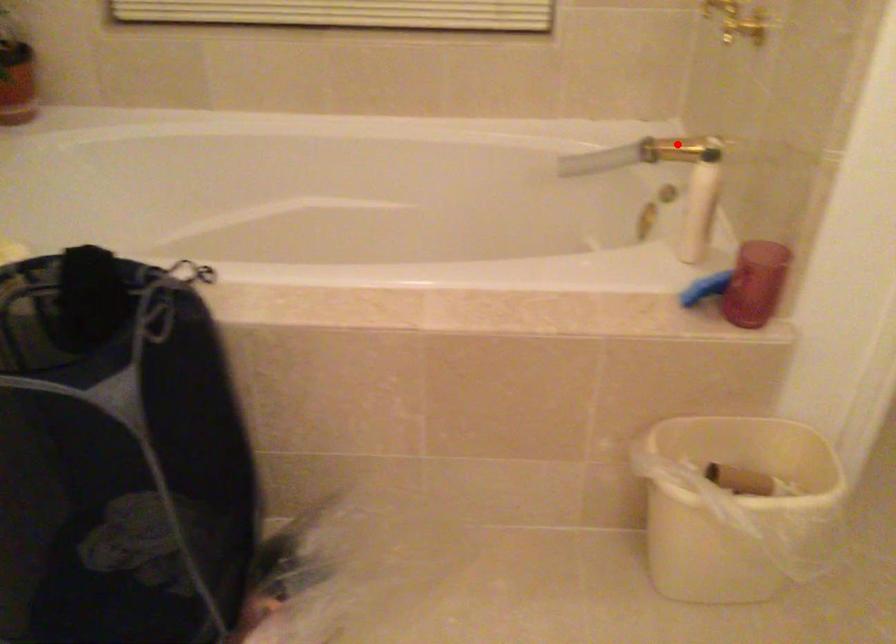
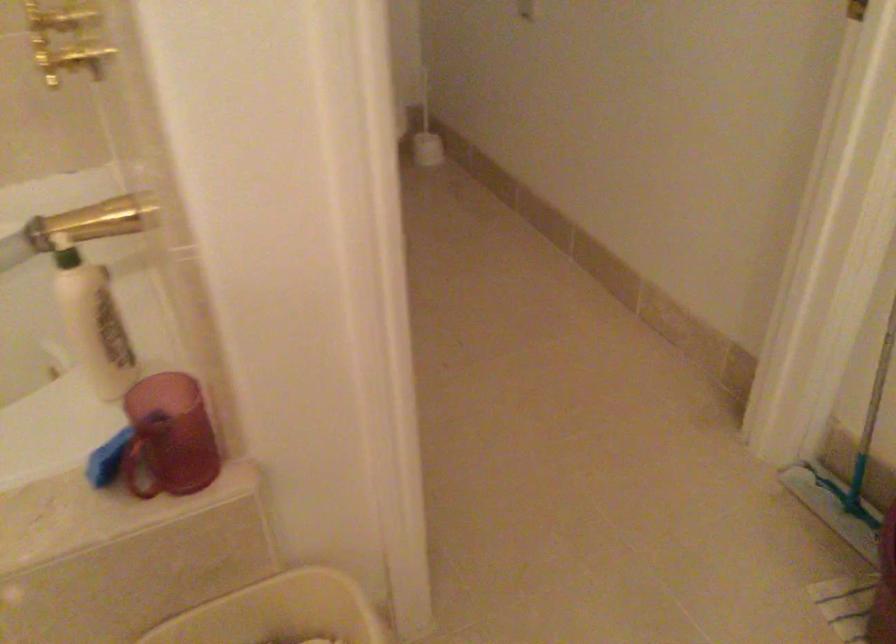
Where in the second image is the point corresponding to the highlighted location from the first image?

(95, 222)